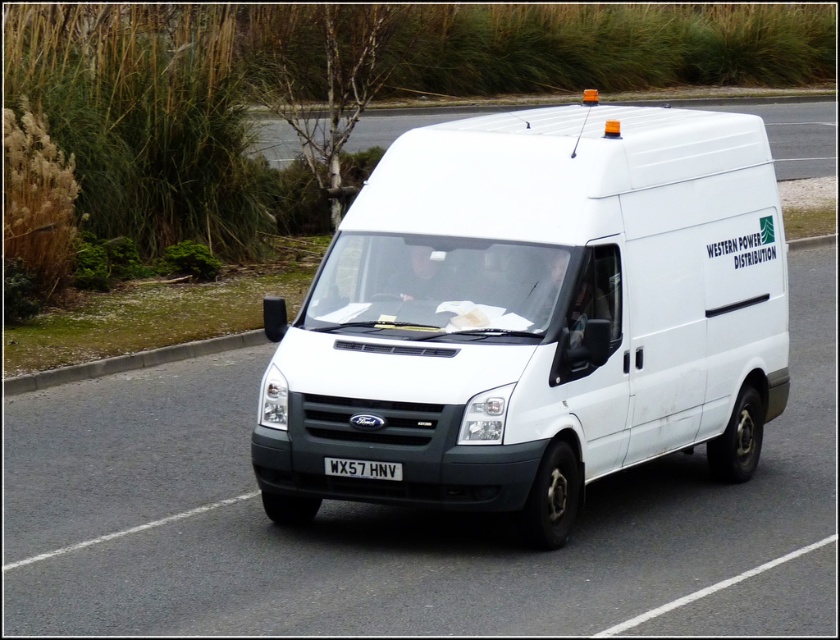
You are a pedestrian standing on the sidewalk and see the white matte van at center and the black plastic license plate at center. Which object is closer to you?

The white matte van at center is closer to you because it is in front of the black plastic license plate at center.

You are a traffic officer observing a white matte van at center driving on the road. You notice a black plastic license plate at center. Is the license plate visible to you from your current viewpoint?

The white matte van at center is positioned over the black plastic license plate at center, so the license plate is not visible from this viewpoint.

You are a pedestrian standing on the sidewalk and see the white Ford van driving on the road. There are two points marked on the van at coordinates point (806,129) and point (371,470). Which point is closer to you?

Point (806,129) is further to the viewer than point (371,470), so the point closer to you is point (371,470).